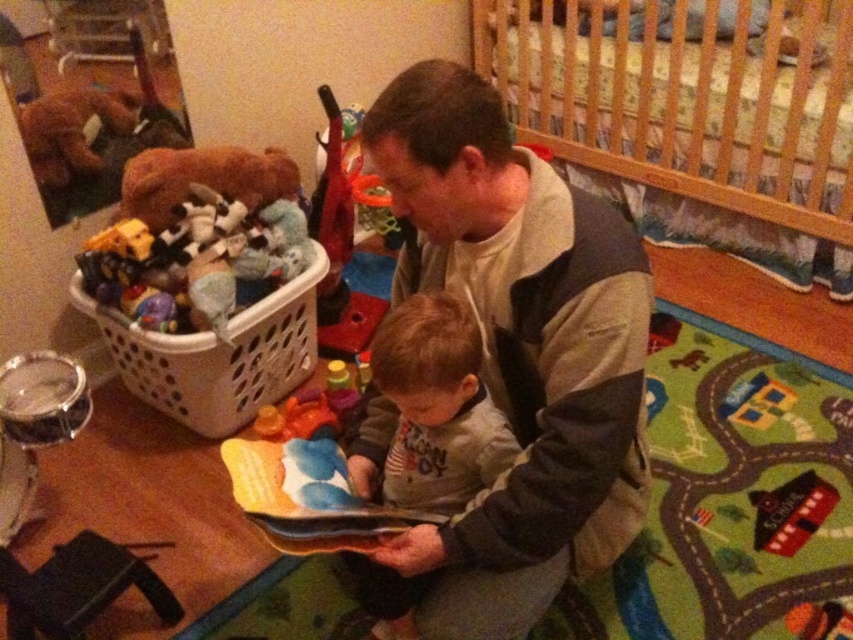
Who is more distant from viewer, (222, 316) or (254, 356)?

The point (254, 356) is more distant.

How far apart are soft plush toys at left and white plastic basket at left?

The distance of soft plush toys at left from white plastic basket at left is 5.28 inches.

Is point (131, 300) positioned behind point (268, 371)?

No, it is in front of (268, 371).

Find the location of a particular element. The image size is (853, 640). soft plush toys at left is located at coordinates (196, 260).

Is point (711, 188) in front of point (247, 291)?

No, it is behind (247, 291).

Looking at this image, is wooden crib at upper right to the right of soft plush toys at left from the viewer's perspective?

Indeed, wooden crib at upper right is positioned on the right side of soft plush toys at left.

Between point (848, 230) and point (149, 276), which one is positioned behind?

The point (848, 230) is behind.

This screenshot has width=853, height=640. I want to click on wooden crib at upper right, so click(x=693, y=116).

Is wooden crib at upper right closer to the viewer compared to gray cotton shirt at center?

No, wooden crib at upper right is further to the viewer.

Does point (701, 220) come farther from viewer compared to point (457, 464)?

Yes, it is.

Where is `wooden crib at upper right`? This screenshot has width=853, height=640. wooden crib at upper right is located at coordinates (693, 116).

The image size is (853, 640). What are the coordinates of `wooden crib at upper right` in the screenshot? It's located at (693, 116).